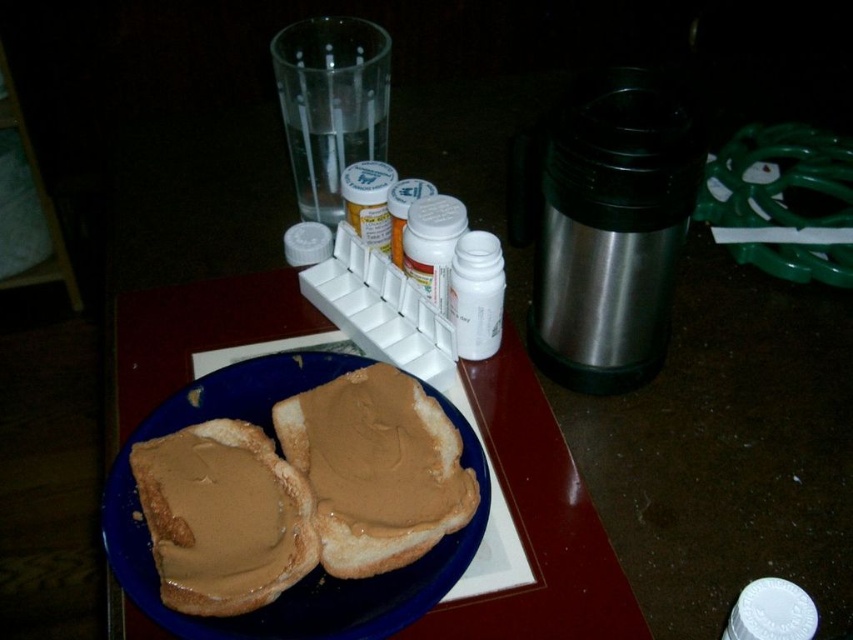
Does blue matte plate at center appear on the right side of brown matte peanut butter sandwich at center?

In fact, blue matte plate at center is to the left of brown matte peanut butter sandwich at center.

Is point (229, 388) less distant than point (425, 483)?

No, it is not.

The image size is (853, 640). What are the coordinates of `blue matte plate at center` in the screenshot? It's located at 317,566.

Who is higher up, brown matte peanut butter sandwich at center or brown matte peanut butter spread at center?

brown matte peanut butter sandwich at center is above.

Does point (447, 472) lie behind point (228, 493)?

Yes.

This screenshot has width=853, height=640. I want to click on brown matte peanut butter sandwich at center, so click(376, 468).

Between blue matte plate at center and brown matte peanut butter spread at center, which one is positioned higher?

blue matte plate at center is higher up.

Describe the element at coordinates (317, 566) in the screenshot. I see `blue matte plate at center` at that location.

Is point (376, 577) positioned behind point (312, 566)?

Yes, it is behind point (312, 566).

Where is `blue matte plate at center`? This screenshot has width=853, height=640. blue matte plate at center is located at coordinates (317, 566).